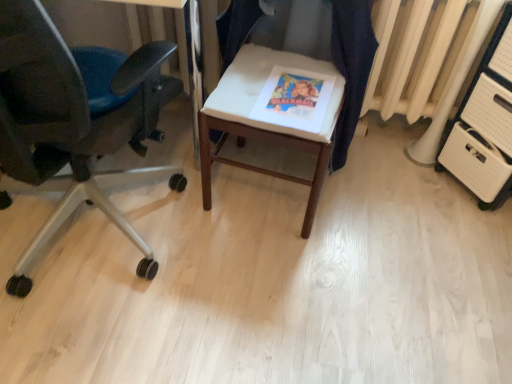
This screenshot has width=512, height=384. Identify the location of free space in front of white plastic file cabinet at right. (475, 238).